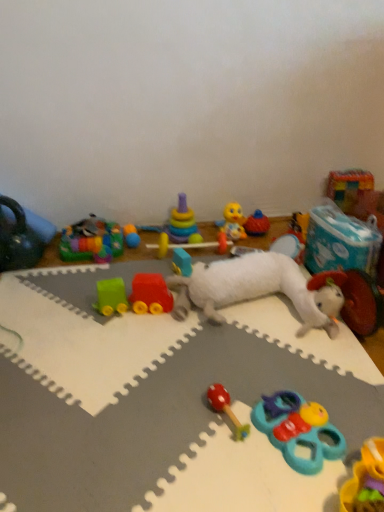
This screenshot has width=384, height=512. What are the coordinates of `vacant space to the left of stacked plastic rings at center, which is the 12th toy from right to left` in the screenshot? It's located at (150, 243).